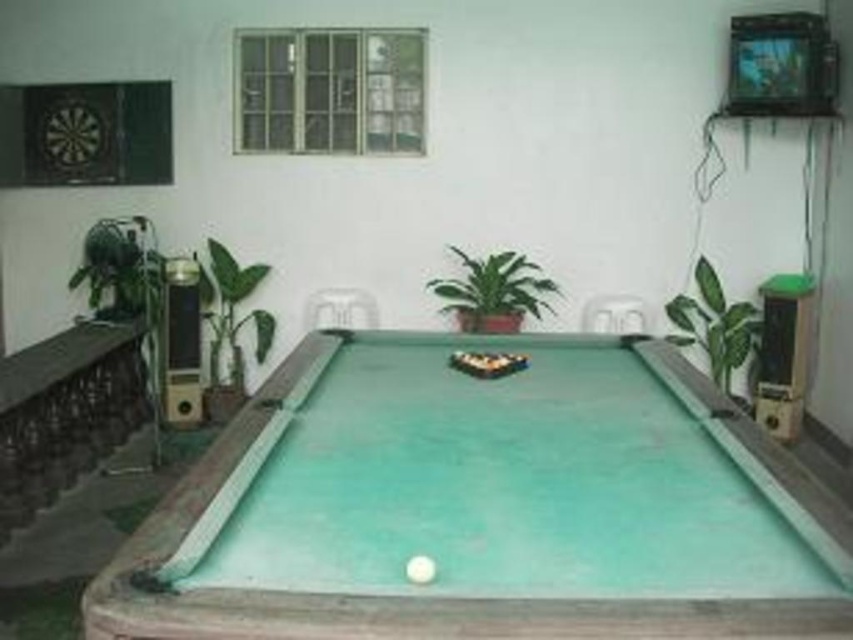
You are a delivery person who needs to place a package between the green glossy plant at center and the green leafy plant at right. The package is 36 inches long. Will there be enough space to fit it between them?

The distance between the green glossy plant at center and the green leafy plant at right is 38.56 inches. Since the package is 36 inches long, there is enough space to fit it between them.

Based on the photo, you are standing in the recreational room and want to reach the point marked as point (825, 522). Considering the pool table and other objects in the scene, can you estimate how far you need to walk from your current position to reach that point?

The distance between point (825, 522) and the viewer is 5.66 feet, so you need to walk approximately 5.66 feet to reach that point.